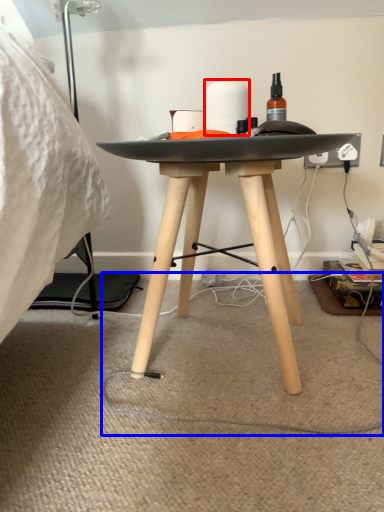
Question: Which object is further to the camera taking this photo, toilet paper (highlighted by a red box) or string (highlighted by a blue box)?

Choices:
 (A) toilet paper
 (B) string

Answer: (A)